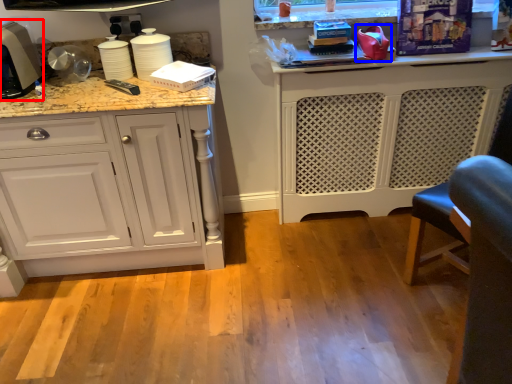
Question: Which point is closer to the camera, home appliance (highlighted by a red box) or appliance (highlighted by a blue box)?

Choices:
 (A) home appliance
 (B) appliance

Answer: (A)